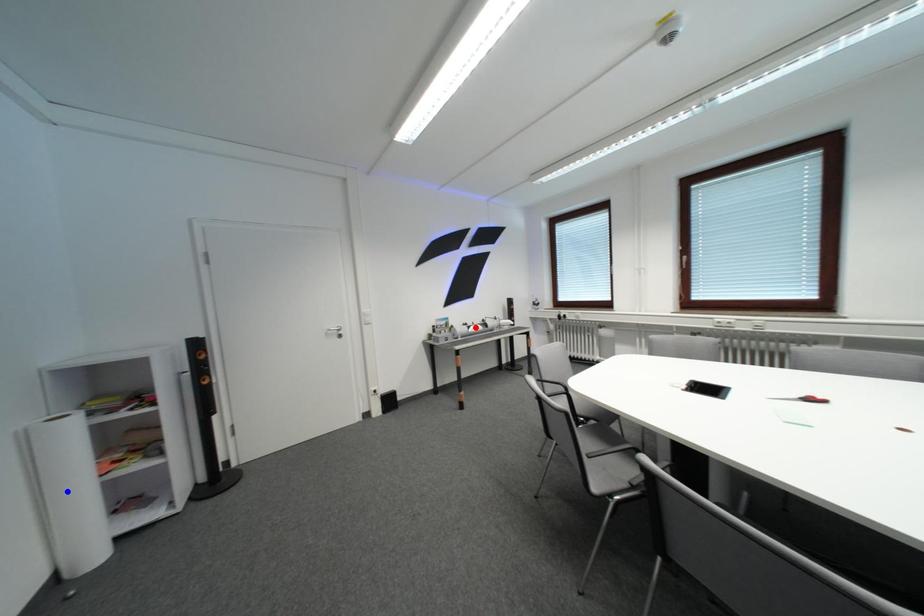
Question: In the image, two points are highlighted. Which point is nearer to the camera? Reply with the corresponding letter.

Choices:
 (A) blue point
 (B) red point

Answer: (A)